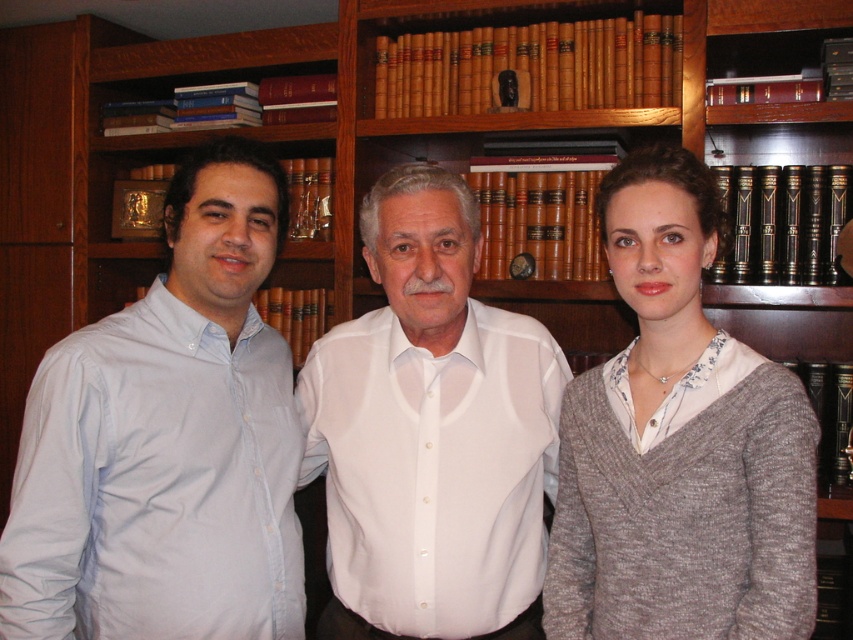
Which is below, light blue cotton shirt at left or knit gray sweater at center?

knit gray sweater at center

Does light blue cotton shirt at left have a lesser height compared to knit gray sweater at center?

No, light blue cotton shirt at left is not shorter than knit gray sweater at center.

Locate an element on the screen. The height and width of the screenshot is (640, 853). light blue cotton shirt at left is located at coordinates (167, 440).

Is knit gray sweater at center closer to the viewer compared to white smooth shirt at center?

Yes.

Between knit gray sweater at center and white smooth shirt at center, which one has more height?

white smooth shirt at center is taller.

You are a GUI agent. You are given a task and a screenshot of the screen. Output one action in this format:
    pyautogui.click(x=<x>, y=<y>)
    Task: Click on the knit gray sweater at center
    Image resolution: width=853 pixels, height=640 pixels.
    Given the screenshot: What is the action you would take?
    pyautogui.click(x=679, y=445)

Is light blue cotton shirt at left smaller than white smooth shirt at center?

No.

Does light blue cotton shirt at left have a greater width compared to white smooth shirt at center?

Incorrect, light blue cotton shirt at left's width does not surpass white smooth shirt at center's.

Between point (216, 545) and point (375, 392), which one is positioned behind?

Point (375, 392)

The width and height of the screenshot is (853, 640). I want to click on light blue cotton shirt at left, so click(167, 440).